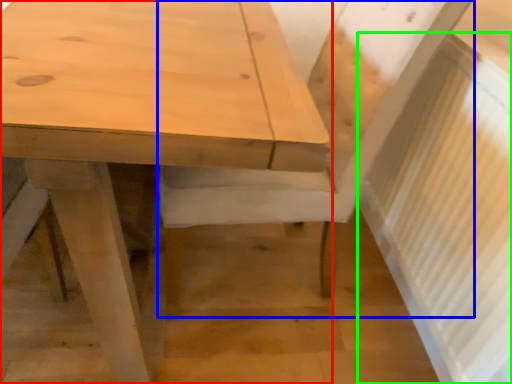
Question: Which object is the closest to the table (highlighted by a red box)? Choose among these: chair (highlighted by a blue box) or radiator (highlighted by a green box).

Choices:
 (A) chair
 (B) radiator

Answer: (A)